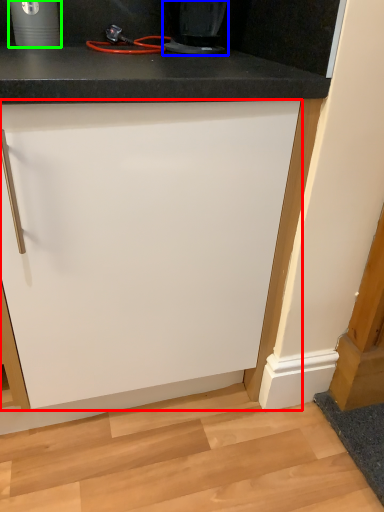
Question: Based on their relative distances, which object is farther from cabinetry (highlighted by a red box)? Choose from home appliance (highlighted by a blue box) and appliance (highlighted by a green box).

Choices:
 (A) home appliance
 (B) appliance

Answer: (B)